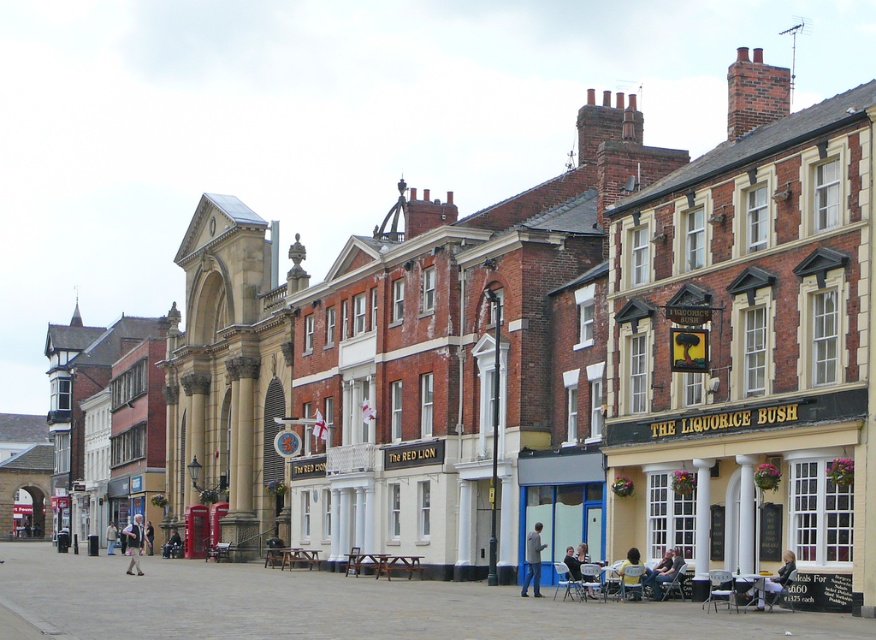
You are standing at the center of the urban street scene. There is a point at coordinates (532, 561). What object is located at that point?

Answer: The point at coordinates (532, 561) is located on blue jeans at lower right.